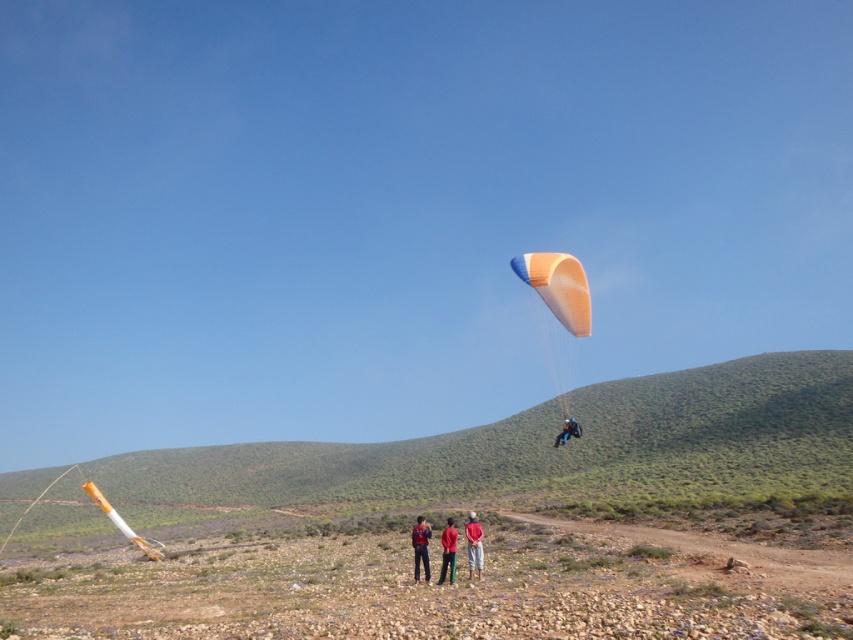
Question: Considering the relative positions of orange fabric parachute at center and red fabric jacket at center in the image provided, where is orange fabric parachute at center located with respect to red fabric jacket at center?

Choices:
 (A) left
 (B) right

Answer: (B)

Question: Among these objects, which one is farthest from the camera?

Choices:
 (A) red cotton shirt at center
 (B) red fabric jacket at center
 (C) orange fabric parachute at center
 (D) dark blue fabric parachute at upper center

Answer: (D)

Question: Can you confirm if red cotton shirt at center is bigger than red fabric jacket at center?

Choices:
 (A) no
 (B) yes

Answer: (A)

Question: Which point is closer to the camera taking this photo?

Choices:
 (A) (567, 429)
 (B) (415, 545)
 (C) (451, 525)
 (D) (480, 541)

Answer: (C)

Question: From the image, what is the correct spatial relationship of red fabric jacket at center in relation to dark blue fabric parachute at upper center?

Choices:
 (A) above
 (B) below

Answer: (A)

Question: Which point appears farthest from the camera in this image?

Choices:
 (A) (477, 544)
 (B) (439, 579)
 (C) (550, 259)

Answer: (C)